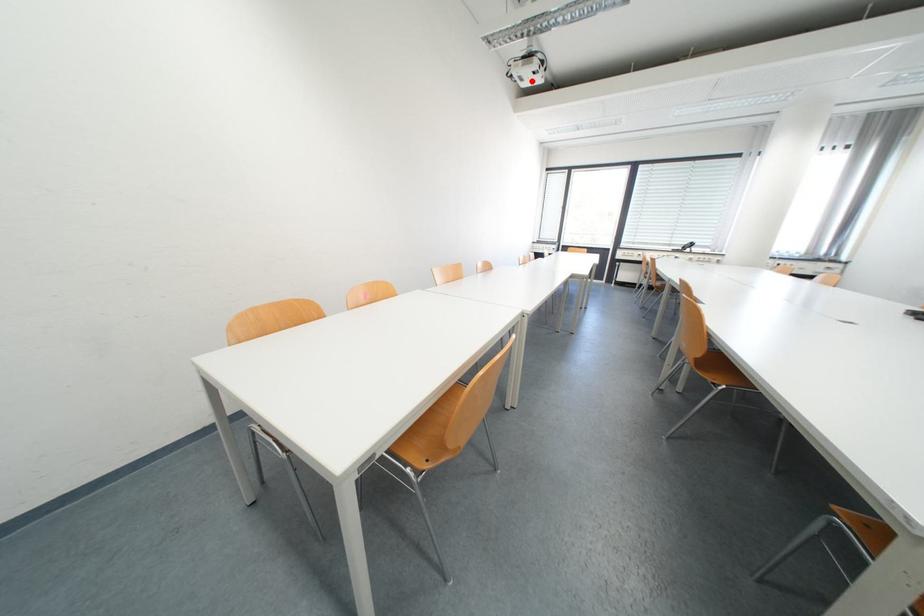
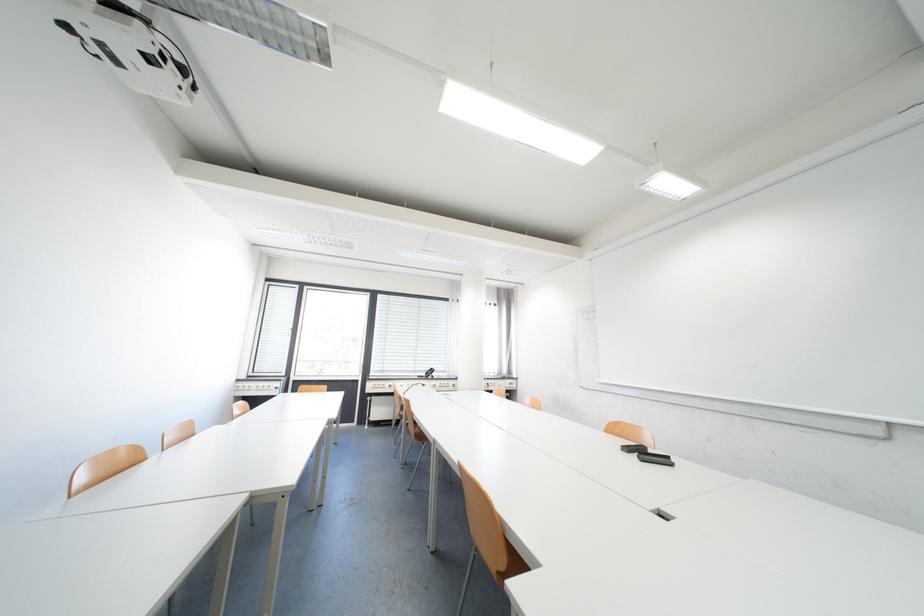
Locate, in the second image, the point that corresponds to the highlighted location in the first image.

(128, 63)